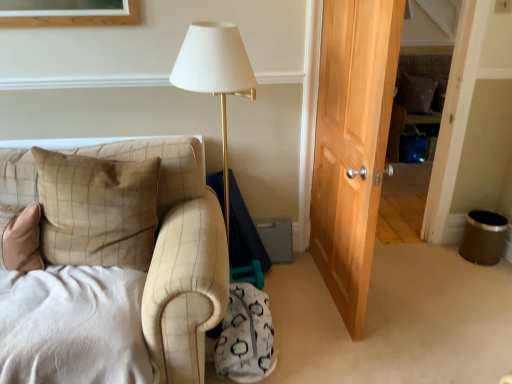
Image resolution: width=512 pixels, height=384 pixels. Find the location of `beige plaid pillow at left, positioned as the first pillow in left-to-right order`. beige plaid pillow at left, positioned as the first pillow in left-to-right order is located at coordinates tap(97, 209).

Describe the element at coordinates (97, 209) in the screenshot. This screenshot has height=384, width=512. I see `beige plaid pillow at left, which is counted as the 2th pillow, starting from the right` at that location.

In order to face velvet brown pillow at upper right, placed as the first pillow when sorted from right to left, should I rotate leftwards or rightwards?

You should look right and rotate roughly 20.695 degrees.

What do you see at coordinates (416, 93) in the screenshot? The width and height of the screenshot is (512, 384). I see `velvet brown pillow at upper right, acting as the second pillow starting from the bottom` at bounding box center [416, 93].

Locate an element on the screen. velvet brown pillow at upper right, placed as the first pillow when sorted from right to left is located at coordinates (416, 93).

How much space does velvet brown pillow at upper right, acting as the 1th pillow starting from the back, occupy vertically?

13.89 inches.

Image resolution: width=512 pixels, height=384 pixels. I want to click on beige plaid pillow at left, which ranks as the 2th pillow in back-to-front order, so click(x=97, y=209).

Considering the positions of objects beige plaid pillow at left, which is counted as the 2th pillow, starting from the right, and velvet brown pillow at upper right, acting as the second pillow starting from the bottom, in the image provided, who is more to the left, beige plaid pillow at left, which is counted as the 2th pillow, starting from the right, or velvet brown pillow at upper right, acting as the second pillow starting from the bottom,?

beige plaid pillow at left, which is counted as the 2th pillow, starting from the right.

Which is in front, beige plaid pillow at left, positioned as the first pillow in left-to-right order, or velvet brown pillow at upper right, which is counted as the 2th pillow, starting from the front?

beige plaid pillow at left, positioned as the first pillow in left-to-right order, is closer to the camera.

Does point (99, 260) appear closer or farther from the camera than point (405, 81)?

Point (99, 260) is positioned closer to the camera compared to point (405, 81).

From the image's perspective, relative to velvet brown pillow at upper right, acting as the second pillow starting from the bottom, is beige plaid pillow at left, the 1th pillow from the front, above or below?

From the image's perspective, beige plaid pillow at left, the 1th pillow from the front, appears below velvet brown pillow at upper right, acting as the second pillow starting from the bottom.

From a real-world perspective, does beige plaid pillow at left, which is counted as the 2th pillow, starting from the right, stand above velvet brown pillow at upper right, the first pillow when ordered from top to bottom?

Indeed, from a real-world perspective, beige plaid pillow at left, which is counted as the 2th pillow, starting from the right, stands above velvet brown pillow at upper right, the first pillow when ordered from top to bottom.

Considering the sizes of objects beige plaid pillow at left, which ranks as the 2th pillow in back-to-front order, and velvet brown pillow at upper right, the second pillow viewed from the left, in the image provided, who is wider, beige plaid pillow at left, which ranks as the 2th pillow in back-to-front order, or velvet brown pillow at upper right, the second pillow viewed from the left,?

With larger width is beige plaid pillow at left, which ranks as the 2th pillow in back-to-front order.

Can you confirm if beige plaid pillow at left, the second pillow viewed from the top, is taller than velvet brown pillow at upper right, acting as the 1th pillow starting from the back?

Indeed, beige plaid pillow at left, the second pillow viewed from the top, has a greater height compared to velvet brown pillow at upper right, acting as the 1th pillow starting from the back.

Considering the relative sizes of beige plaid pillow at left, positioned as the first pillow in left-to-right order, and velvet brown pillow at upper right, the first pillow when ordered from top to bottom, in the image provided, is beige plaid pillow at left, positioned as the first pillow in left-to-right order, smaller than velvet brown pillow at upper right, the first pillow when ordered from top to bottom,?

Incorrect, beige plaid pillow at left, positioned as the first pillow in left-to-right order, is not smaller in size than velvet brown pillow at upper right, the first pillow when ordered from top to bottom.

Is beige plaid pillow at left, the 1th pillow from the front, completely or partially outside of velvet brown pillow at upper right, acting as the second pillow starting from the bottom?

Absolutely, beige plaid pillow at left, the 1th pillow from the front, is external to velvet brown pillow at upper right, acting as the second pillow starting from the bottom.

Is beige plaid pillow at left, which is counted as the 2th pillow, starting from the right, positioned far away from velvet brown pillow at upper right, which is counted as the 2th pillow, starting from the front?

beige plaid pillow at left, which is counted as the 2th pillow, starting from the right, is positioned a significant distance from velvet brown pillow at upper right, which is counted as the 2th pillow, starting from the front.

Does beige plaid pillow at left, which ranks as the 2th pillow in back-to-front order, turn towards velvet brown pillow at upper right, the first pillow when ordered from top to bottom?

No, beige plaid pillow at left, which ranks as the 2th pillow in back-to-front order, is not facing towards velvet brown pillow at upper right, the first pillow when ordered from top to bottom.

At what (x,y) coordinates should I click in order to perform the action: click on pillow lying above the beige plaid pillow at left, the 1th pillow from the front (from the image's perspective). Please return your answer as a coordinate pair (x, y). The width and height of the screenshot is (512, 384). Looking at the image, I should click on (416, 93).

Between velvet brown pillow at upper right, the second pillow viewed from the left, and beige plaid pillow at left, which is counted as the 2th pillow, starting from the right, which one appears on the right side from the viewer's perspective?

velvet brown pillow at upper right, the second pillow viewed from the left, is more to the right.

Which object is further away from the camera taking this photo, velvet brown pillow at upper right, acting as the 1th pillow starting from the back, or beige plaid pillow at left, which ranks as the 2th pillow in back-to-front order?

velvet brown pillow at upper right, acting as the 1th pillow starting from the back, is further away from the camera.

Is point (429, 105) behind point (113, 181)?

Yes, point (429, 105) is behind point (113, 181).

In the scene shown: From the image's perspective, which is below, velvet brown pillow at upper right, the first pillow when ordered from top to bottom, or beige plaid pillow at left, positioned as the first pillow in left-to-right order?

beige plaid pillow at left, positioned as the first pillow in left-to-right order, from the image's perspective.

Looking at this image, from a real-world perspective, is velvet brown pillow at upper right, acting as the 1th pillow starting from the back, located higher than beige plaid pillow at left, positioned as the first pillow in left-to-right order?

No, from a real-world perspective, velvet brown pillow at upper right, acting as the 1th pillow starting from the back, is not above beige plaid pillow at left, positioned as the first pillow in left-to-right order.

Between velvet brown pillow at upper right, the first pillow when ordered from top to bottom, and beige plaid pillow at left, which ranks as the 2th pillow in back-to-front order, which one has smaller width?

velvet brown pillow at upper right, the first pillow when ordered from top to bottom, is thinner.

Who is taller, velvet brown pillow at upper right, the second pillow viewed from the left, or beige plaid pillow at left, positioned as the first pillow in left-to-right order?

With more height is beige plaid pillow at left, positioned as the first pillow in left-to-right order.

Is velvet brown pillow at upper right, acting as the second pillow starting from the bottom, bigger or smaller than beige plaid pillow at left, the second pillow viewed from the top?

Clearly, velvet brown pillow at upper right, acting as the second pillow starting from the bottom, is smaller in size than beige plaid pillow at left, the second pillow viewed from the top.

Consider the image. Would you say beige plaid pillow at left, which ranks as the 2th pillow in back-to-front order, is part of velvet brown pillow at upper right, which is counted as the 2th pillow, starting from the front,'s contents?

No, beige plaid pillow at left, which ranks as the 2th pillow in back-to-front order, is not inside velvet brown pillow at upper right, which is counted as the 2th pillow, starting from the front.

Is velvet brown pillow at upper right, which is counted as the 2th pillow, starting from the front, next to beige plaid pillow at left, the second pillow viewed from the top?

There is a gap between velvet brown pillow at upper right, which is counted as the 2th pillow, starting from the front, and beige plaid pillow at left, the second pillow viewed from the top.

Could you tell me if velvet brown pillow at upper right, the first pillow when ordered from top to bottom, is facing beige plaid pillow at left, which is the first pillow from bottom to top?

No, velvet brown pillow at upper right, the first pillow when ordered from top to bottom, is not facing towards beige plaid pillow at left, which is the first pillow from bottom to top.

How different are the orientations of velvet brown pillow at upper right, which is counted as the 2th pillow, starting from the front, and beige plaid pillow at left, which is counted as the 2th pillow, starting from the right, in degrees?

3.26 degrees.

How much distance is there between velvet brown pillow at upper right, the second pillow viewed from the left, and beige plaid pillow at left, which is counted as the 2th pillow, starting from the right?

A distance of 3.40 meters exists between velvet brown pillow at upper right, the second pillow viewed from the left, and beige plaid pillow at left, which is counted as the 2th pillow, starting from the right.

Locate an element on the screen. The height and width of the screenshot is (384, 512). pillow in front of the velvet brown pillow at upper right, which is counted as the 2th pillow, starting from the front is located at coordinates (97, 209).

I want to click on pillow in front of the velvet brown pillow at upper right, the first pillow when ordered from top to bottom, so click(97, 209).

Where is `pillow below the velvet brown pillow at upper right, acting as the 1th pillow starting from the back (from the image's perspective)`? pillow below the velvet brown pillow at upper right, acting as the 1th pillow starting from the back (from the image's perspective) is located at coordinates (97, 209).